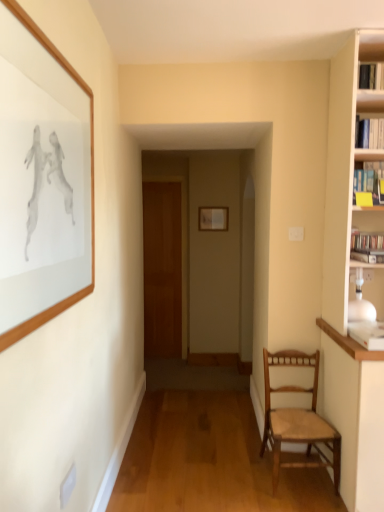
Question: Can you confirm if wooden door at center is thinner than hardcover book at right?

Choices:
 (A) yes
 (B) no

Answer: (A)

Question: Could hardcover book at right be considered to be inside wooden door at center?

Choices:
 (A) yes
 (B) no

Answer: (B)

Question: Is wooden door at center further to camera compared to hardcover book at right?

Choices:
 (A) yes
 (B) no

Answer: (A)

Question: Can you confirm if wooden door at center is shorter than hardcover book at right?

Choices:
 (A) yes
 (B) no

Answer: (B)

Question: Is wooden door at center not close to hardcover book at right?

Choices:
 (A) no
 (B) yes

Answer: (B)

Question: Does wooden door at center have a smaller size compared to hardcover book at right?

Choices:
 (A) no
 (B) yes

Answer: (A)

Question: Is wooden woven seat chair at right wider than wooden picture frame at upper left, the first picture frame positioned from the front?

Choices:
 (A) yes
 (B) no

Answer: (A)

Question: Considering the relative sizes of wooden woven seat chair at right and wooden picture frame at upper left, which is the second picture frame in right-to-left order, in the image provided, is wooden woven seat chair at right thinner than wooden picture frame at upper left, which is the second picture frame in right-to-left order,?

Choices:
 (A) no
 (B) yes

Answer: (A)

Question: From the image's perspective, does wooden woven seat chair at right appear lower than wooden picture frame at upper left, which is the second picture frame in right-to-left order?

Choices:
 (A) yes
 (B) no

Answer: (A)

Question: From a real-world perspective, does wooden woven seat chair at right stand above wooden picture frame at upper left, marked as the 1th picture frame in a left-to-right arrangement?

Choices:
 (A) no
 (B) yes

Answer: (A)

Question: Would you say wooden picture frame at upper left, marked as the second picture frame in a back-to-front arrangement, is part of wooden woven seat chair at right's contents?

Choices:
 (A) yes
 (B) no

Answer: (B)

Question: Is wooden woven seat chair at right oriented away from wooden picture frame at upper left, the first picture frame positioned from the front?

Choices:
 (A) no
 (B) yes

Answer: (A)

Question: Is wooden woven seat chair at right facing away from wooden door at center?

Choices:
 (A) no
 (B) yes

Answer: (A)